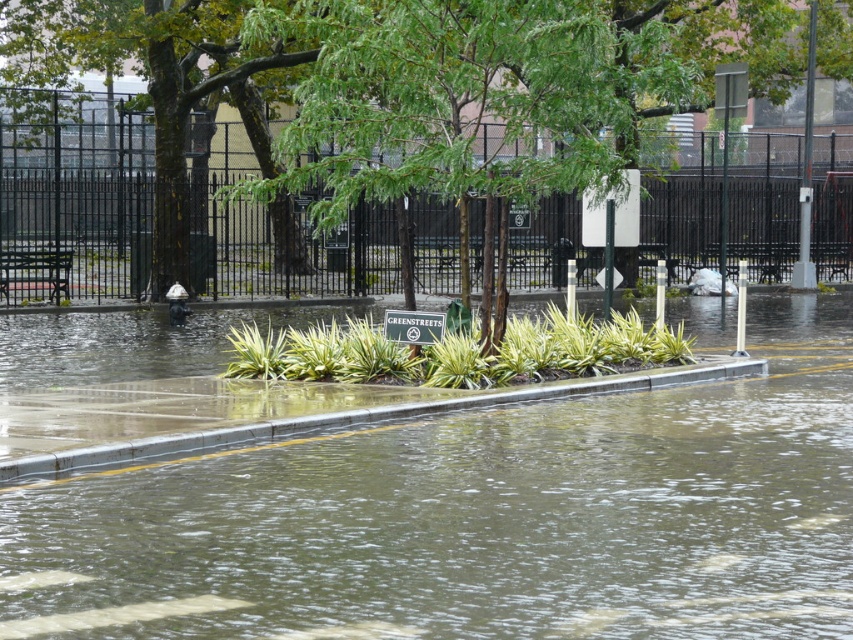
Question: Can you confirm if brown muddy water at center is smaller than concrete at lower center?

Choices:
 (A) yes
 (B) no

Answer: (B)

Question: Which point is closer to the camera?

Choices:
 (A) (718, 364)
 (B) (352, 49)
 (C) (231, 515)

Answer: (C)

Question: Is brown muddy water at center below green leafy tree at center?

Choices:
 (A) no
 (B) yes

Answer: (B)

Question: Can you confirm if green leafy tree at center is bigger than concrete at lower center?

Choices:
 (A) no
 (B) yes

Answer: (B)

Question: Which object is positioned closest to the green leafy tree at center?

Choices:
 (A) concrete at lower center
 (B) brown muddy water at center

Answer: (B)

Question: Which object is positioned closest to the concrete at lower center?

Choices:
 (A) green leafy tree at center
 (B) brown muddy water at center

Answer: (B)